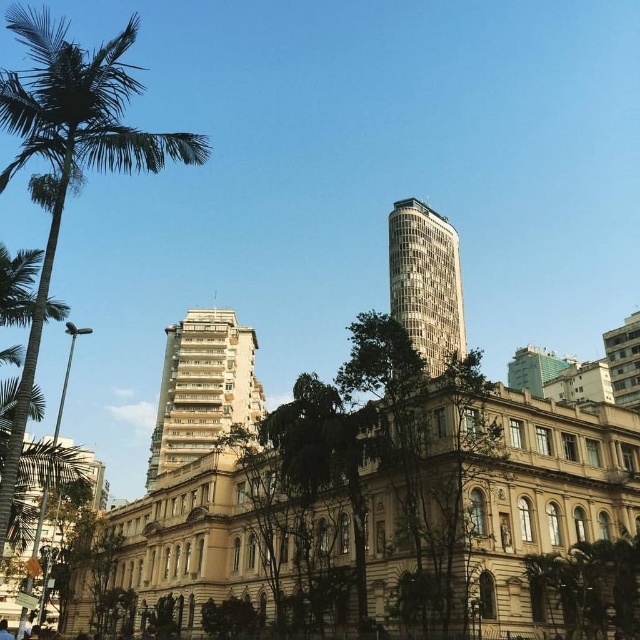
Who is positioned more to the left, green leafy palm tree at left or silver glass tower at upper right?

green leafy palm tree at left

Which of these two, green leafy palm tree at left or silver glass tower at upper right, stands shorter?

silver glass tower at upper right

Which is behind, point (189, 141) or point (429, 259)?

Positioned behind is point (429, 259).

You are a GUI agent. You are given a task and a screenshot of the screen. Output one action in this format:
    pyautogui.click(x=<x>, y=<y>)
    Task: Click on the green leafy palm tree at left
    
    Given the screenshot: What is the action you would take?
    pyautogui.click(x=68, y=154)

Looking at this image, between green leafy tree at center and gray concrete building at upper right, which one appears on the left side from the viewer's perspective?

green leafy tree at center

Can you confirm if green leafy tree at center is positioned above gray concrete building at upper right?

Incorrect, green leafy tree at center is not positioned above gray concrete building at upper right.

This screenshot has height=640, width=640. Find the location of `green leafy tree at center`. green leafy tree at center is located at coordinates (374, 460).

Which is behind, point (426, 452) or point (246, 426)?

The point (246, 426) is more distant.

Between green leafy tree at center and white textured building at center, which one has less height?

green leafy tree at center

Who is more forward, (x=230, y=438) or (x=260, y=396)?

Positioned in front is point (x=230, y=438).

Where is `green leafy tree at center`? Image resolution: width=640 pixels, height=640 pixels. green leafy tree at center is located at coordinates (374, 460).